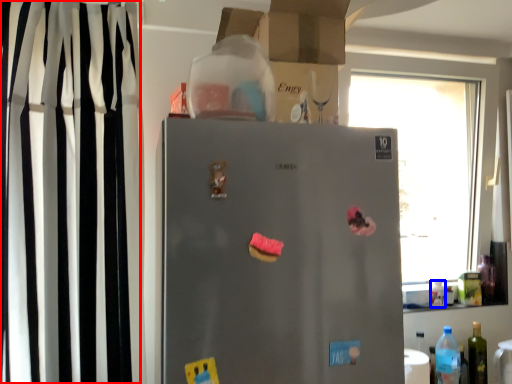
Question: Which object is further to the camera taking this photo, curtain (highlighted by a red box) or bottle (highlighted by a blue box)?

Choices:
 (A) curtain
 (B) bottle

Answer: (B)